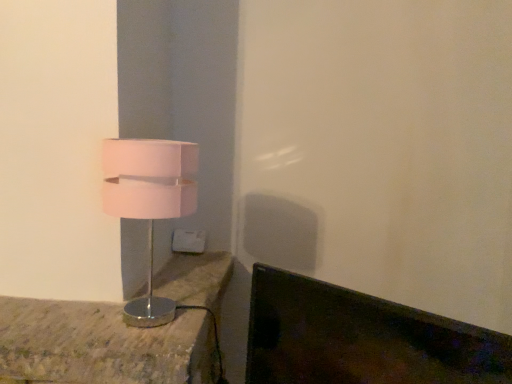
Question: Is point (200, 241) positioned closer to the camera than point (150, 157)?

Choices:
 (A) closer
 (B) farther

Answer: (B)

Question: In terms of height, does white plastic electric outlet at center look taller or shorter compared to pink matte lampshade at left?

Choices:
 (A) tall
 (B) short

Answer: (B)

Question: Which object is positioned closest to the pink matte lampshade at left?

Choices:
 (A) metallic silver lamp at left
 (B) white plastic electric outlet at center

Answer: (A)

Question: Which is nearer to the white plastic electric outlet at center?

Choices:
 (A) metallic silver lamp at left
 (B) pink matte lampshade at left

Answer: (A)